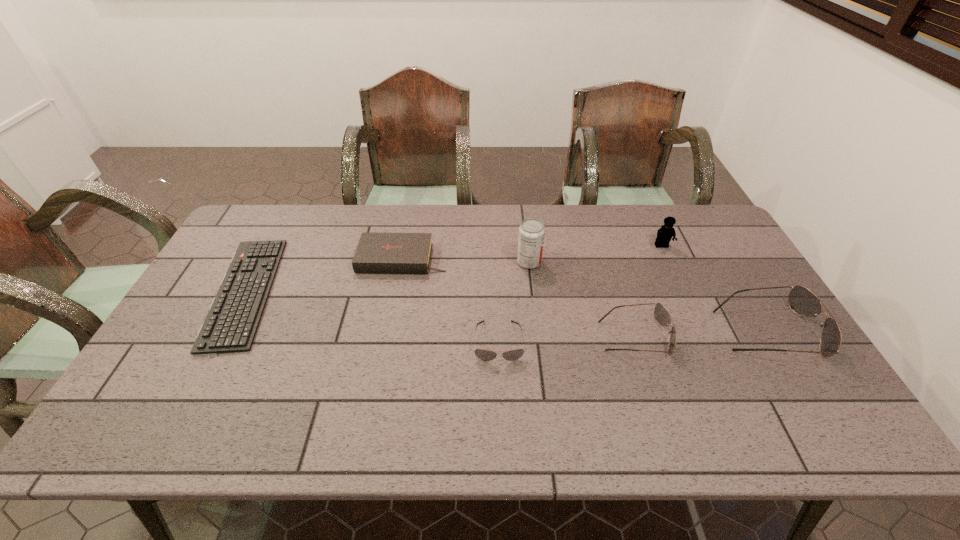
Locate an element on the screen. The image size is (960, 540). object that stands as the third closest to the computer keyboard is located at coordinates (531, 231).

Point out which object is positioned as the fifth nearest to the second sunglasses from left to right. Please provide its 2D coordinates. Your answer should be formatted as a tuple, i.e. [(x, y)], where the tuple contains the x and y coordinates of a point satisfying the conditions above.

[(383, 253)]

Image resolution: width=960 pixels, height=540 pixels. I want to click on sunglasses object that ranks as the third closest to the computer keyboard, so click(x=803, y=302).

Identify which sunglasses is the third closest to the leftmost object. Please provide its 2D coordinates. Your answer should be formatted as a tuple, i.e. [(x, y)], where the tuple contains the x and y coordinates of a point satisfying the conditions above.

[(803, 302)]

This screenshot has width=960, height=540. What are the coordinates of `free space in the image that satisfies the following two spatial constraints: 1. on the front-facing side of the tallest sunglasses; 2. on the front-facing side of the fifth object from right to left` in the screenshot? It's located at (773, 341).